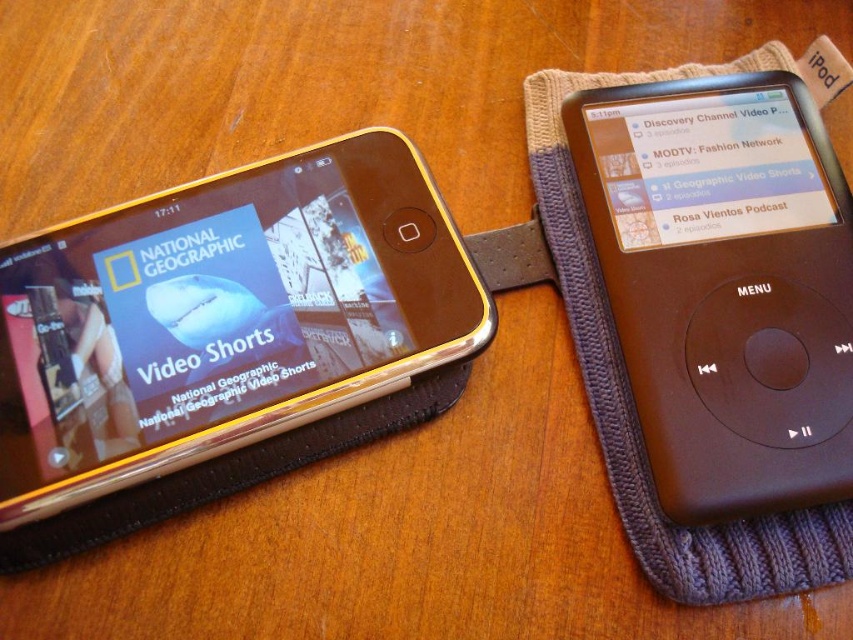
Does gold metallic smartphone at left come behind black matte ipod at right?

No, it is in front of black matte ipod at right.

Which is behind, point (113, 225) or point (637, 140)?

Point (637, 140)

Locate an element on the screen. gold metallic smartphone at left is located at coordinates (225, 316).

At what (x,y) coordinates should I click in order to perform the action: click on gold metallic smartphone at left. Please return your answer as a coordinate pair (x, y). The height and width of the screenshot is (640, 853). Looking at the image, I should click on (225, 316).